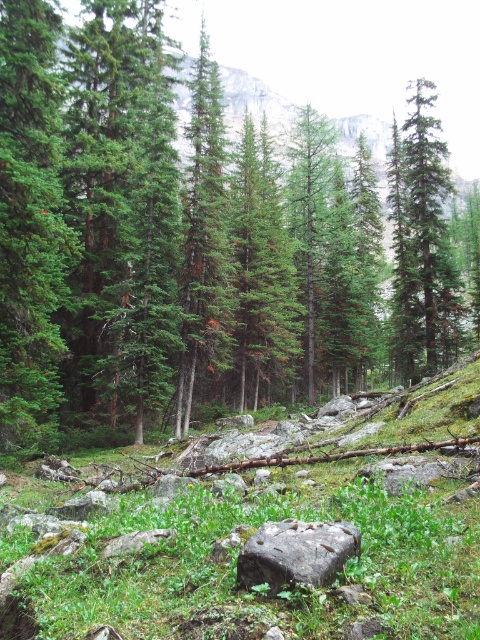
You are standing in the forest and want to locate the green matte tree at center. Based on the coordinates provided, can you estimate its position relative to the center of the image?

The green matte tree at center is located at coordinates approximately 0.380 on the x and 0.383 on the y axis, which places it very close to the center of the image.

You are a hiker trying to navigate through the forest. You see a green matte tree at center and a green matte tree at upper right. Which tree would block your view more if you were standing directly in front of them?

The green matte tree at center might block your view more since it is wider than the green matte tree at upper right.

You are an environmental scientist assessing the forest. You need to compare the widths of the green matte tree at upper right and the gray rough rock at center. Which one is wider?

The green matte tree at upper right is wider than the gray rough rock at center because its width surpasses the rock.